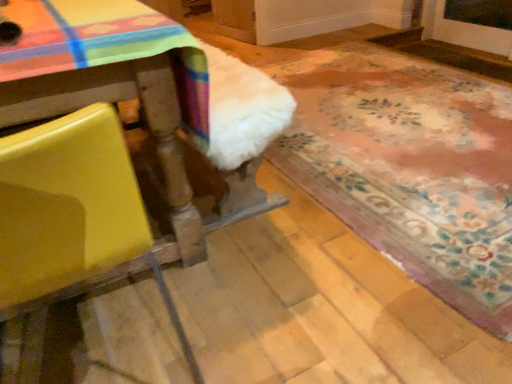
The height and width of the screenshot is (384, 512). Describe the element at coordinates (408, 165) in the screenshot. I see `white fluffy rug at lower right` at that location.

This screenshot has height=384, width=512. In order to click on white fluffy rug at lower right in this screenshot , I will do `click(408, 165)`.

What is the approximate width of yellow matte chair at left?

The width of yellow matte chair at left is 20.94 inches.

The height and width of the screenshot is (384, 512). What do you see at coordinates (72, 211) in the screenshot? I see `yellow matte chair at left` at bounding box center [72, 211].

In order to face yellow matte chair at left, should I rotate leftwards or rightwards?

You should look left and rotate roughly 25.175 degrees.

At what (x,y) coordinates should I click in order to perform the action: click on yellow matte chair at left. Please return your answer as a coordinate pair (x, y). This screenshot has width=512, height=384. Looking at the image, I should click on (72, 211).

At what (x,y) coordinates should I click in order to perform the action: click on white fluffy rug at lower right. Please return your answer as a coordinate pair (x, y). Looking at the image, I should click on (408, 165).

From the picture: Considering the positions of objects yellow matte chair at left and white fluffy rug at lower right in the image provided, who is more to the right, yellow matte chair at left or white fluffy rug at lower right?

white fluffy rug at lower right is more to the right.

Based on the photo, in the image, is yellow matte chair at left positioned in front of or behind white fluffy rug at lower right?

yellow matte chair at left is in front of white fluffy rug at lower right.

Between point (82, 109) and point (294, 57), which one is positioned behind?

Positioned behind is point (294, 57).

Consider the image. From the image's perspective, is yellow matte chair at left above white fluffy rug at lower right?

No, from the image's perspective, yellow matte chair at left is not above white fluffy rug at lower right.

From a real-world perspective, between yellow matte chair at left and white fluffy rug at lower right, who is vertically lower?

white fluffy rug at lower right, from a real-world perspective.

Considering the relative sizes of yellow matte chair at left and white fluffy rug at lower right in the image provided, is yellow matte chair at left thinner than white fluffy rug at lower right?

Yes.

Considering the sizes of objects yellow matte chair at left and white fluffy rug at lower right in the image provided, who is taller, yellow matte chair at left or white fluffy rug at lower right?

Standing taller between the two is yellow matte chair at left.

Considering the sizes of yellow matte chair at left and white fluffy rug at lower right in the image, is yellow matte chair at left bigger or smaller than white fluffy rug at lower right?

Considering their sizes, yellow matte chair at left takes up less space than white fluffy rug at lower right.

Which is correct: yellow matte chair at left is inside white fluffy rug at lower right, or outside of it?

yellow matte chair at left is outside white fluffy rug at lower right.

Are yellow matte chair at left and white fluffy rug at lower right located far from each other?

yellow matte chair at left is far away from white fluffy rug at lower right.

Is yellow matte chair at left looking in the opposite direction of white fluffy rug at lower right?

No.

Consider the image. How different are the orientations of yellow matte chair at left and white fluffy rug at lower right in degrees?

There is a 1.04-degree angle between the facing directions of yellow matte chair at left and white fluffy rug at lower right.

How much distance is there between yellow matte chair at left and white fluffy rug at lower right?

A distance of 1.55 meters exists between yellow matte chair at left and white fluffy rug at lower right.

This screenshot has width=512, height=384. What are the coordinates of `chair that appears above the white fluffy rug at lower right (from a real-world perspective)` in the screenshot? It's located at (72, 211).

Considering the positions of objects white fluffy rug at lower right and yellow matte chair at left in the image provided, who is more to the left, white fluffy rug at lower right or yellow matte chair at left?

yellow matte chair at left is more to the left.

Looking at this image, is the depth of white fluffy rug at lower right less than that of yellow matte chair at left?

No.

Considering the positions of point (367, 129) and point (11, 205), is point (367, 129) closer or farther from the camera than point (11, 205)?

Clearly, point (367, 129) is more distant from the camera than point (11, 205).

From the image's perspective, who appears lower, white fluffy rug at lower right or yellow matte chair at left?

From the image's view, yellow matte chair at left is below.

From a real-world perspective, is white fluffy rug at lower right over yellow matte chair at left?

No, from a real-world perspective, white fluffy rug at lower right is not on top of yellow matte chair at left.

In terms of width, does white fluffy rug at lower right look wider or thinner when compared to yellow matte chair at left?

In the image, white fluffy rug at lower right appears to be wider than yellow matte chair at left.

Considering the relative sizes of white fluffy rug at lower right and yellow matte chair at left in the image provided, is white fluffy rug at lower right taller than yellow matte chair at left?

In fact, white fluffy rug at lower right may be shorter than yellow matte chair at left.

Who is smaller, white fluffy rug at lower right or yellow matte chair at left?

yellow matte chair at left.

Is white fluffy rug at lower right situated inside yellow matte chair at left or outside?

The correct answer is: outside.

Is white fluffy rug at lower right in contact with yellow matte chair at left?

They are not placed beside each other.

Is yellow matte chair at left at the back of white fluffy rug at lower right?

white fluffy rug at lower right is not turned away from yellow matte chair at left.

How many degrees apart are the facing directions of white fluffy rug at lower right and yellow matte chair at left?

1.04 degrees separate the facing orientations of white fluffy rug at lower right and yellow matte chair at left.

Locate an element on the screen. The height and width of the screenshot is (384, 512). mat on the right of yellow matte chair at left is located at coordinates (408, 165).

Where is `mat that is behind the yellow matte chair at left`? mat that is behind the yellow matte chair at left is located at coordinates (408, 165).

At what (x,y) coordinates should I click in order to perform the action: click on chair in front of the white fluffy rug at lower right. Please return your answer as a coordinate pair (x, y). Looking at the image, I should click on (72, 211).